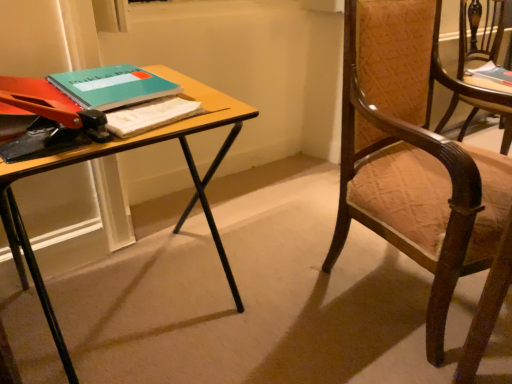
Where is `blank area to the left of wooden chair with upholstered seat at right, which is counted as the 1th chair, starting from the front`? This screenshot has width=512, height=384. blank area to the left of wooden chair with upholstered seat at right, which is counted as the 1th chair, starting from the front is located at coordinates coord(285,288).